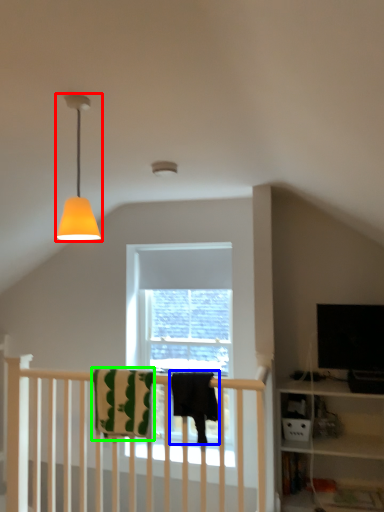
Question: Considering the real-world distances, which object is closest to lamp (highlighted by a red box)? beach towel (highlighted by a blue box) or beach towel (highlighted by a green box).

Choices:
 (A) beach towel
 (B) beach towel

Answer: (A)